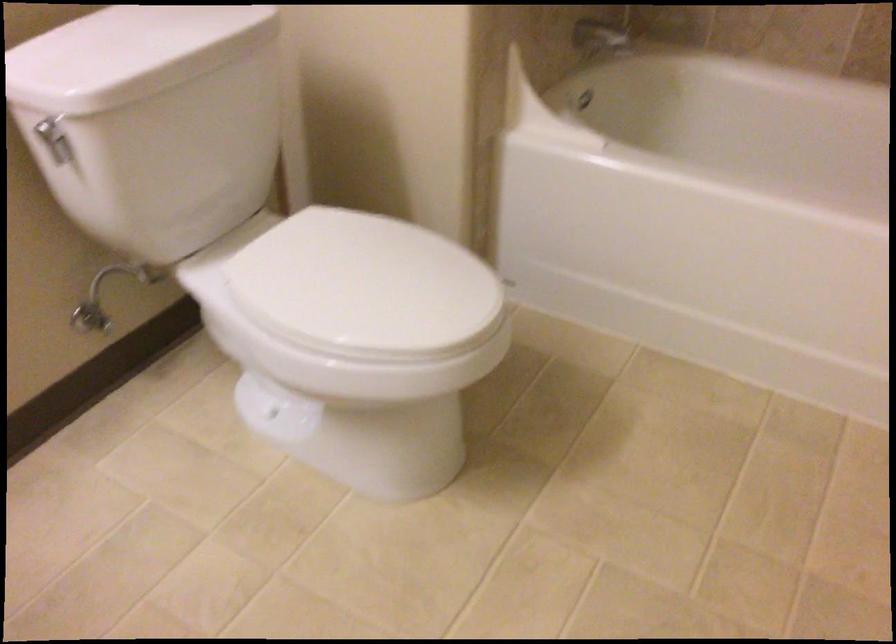
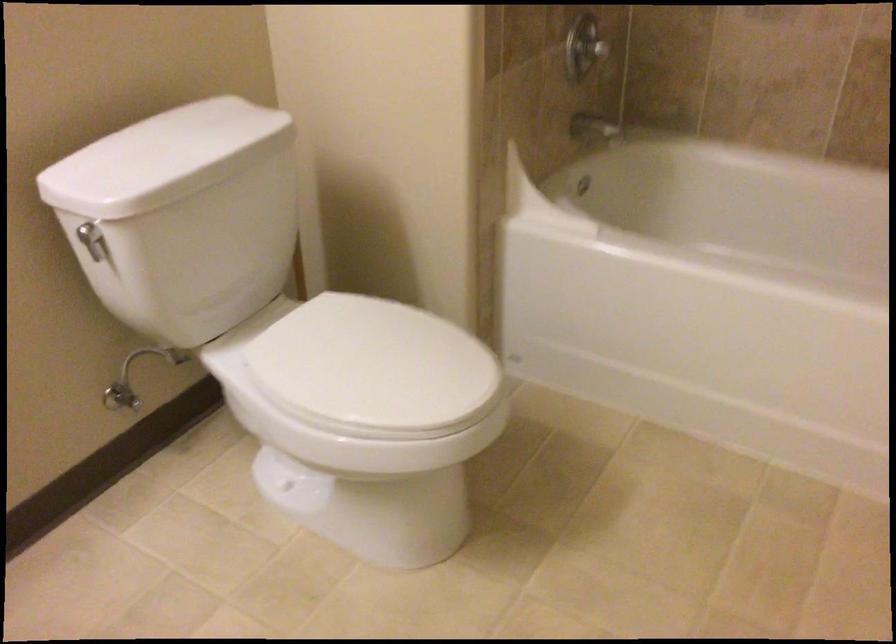
Question: Based on the continuous images, in which direction is the camera rotating? Reply with the corresponding letter.

Choices:
 (A) Left
 (B) Right
 (C) Up
 (D) Down

Answer: (C)